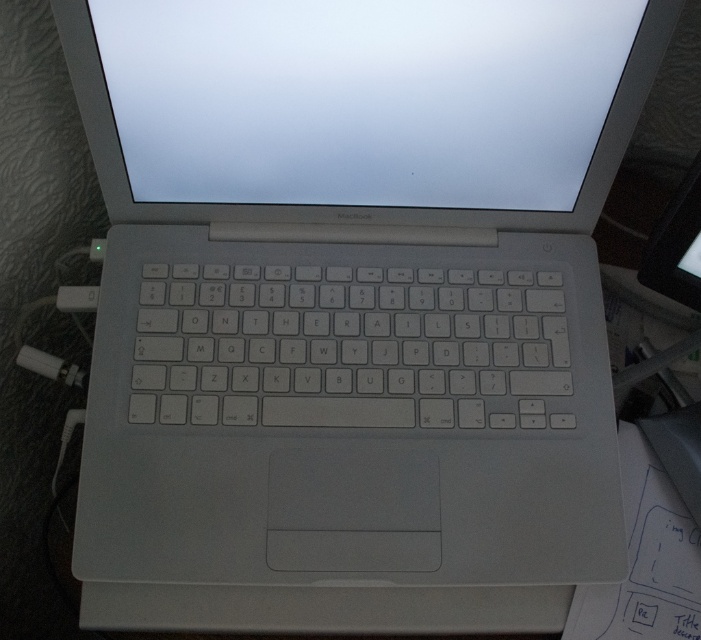
You are setting up a new MacBook and need to connect a charger. You see the white plastic keyboard at center and the white plastic plug at lower left. Which object is closer to you, and where should you plug in the charger?

The white plastic keyboard at center is in front of the white plastic plug at lower left, so the keyboard is closer to you. However, the plug is the correct location for charging, so you should plug the charger into the white plastic plug at lower left.